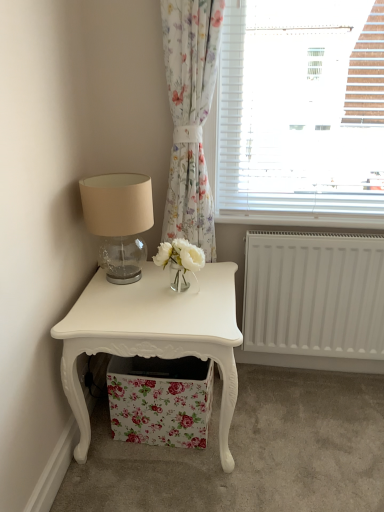
Locate an element on the screen. This screenshot has height=512, width=384. free space in front of white matte radiator at lower right is located at coordinates (314, 438).